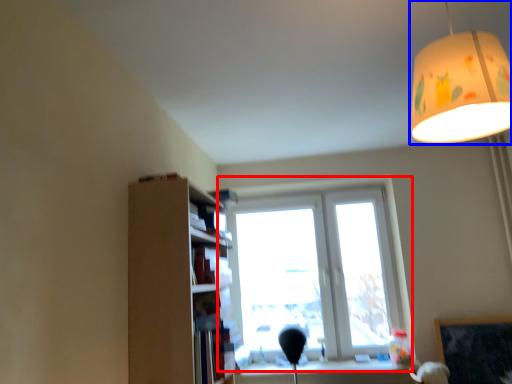
Question: Which point is closer to the camera, window (highlighted by a red box) or lamp (highlighted by a blue box)?

Choices:
 (A) window
 (B) lamp

Answer: (B)